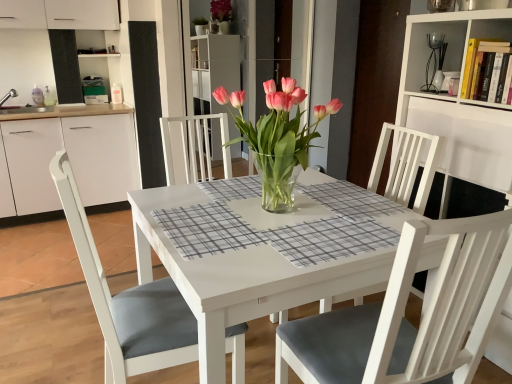
Question: Considering the relative sizes of white wood bookshelf at upper right and white wood chair at center in the image provided, is white wood bookshelf at upper right bigger than white wood chair at center?

Choices:
 (A) no
 (B) yes

Answer: (B)

Question: Is white wood bookshelf at upper right outside white wood chair at center?

Choices:
 (A) yes
 (B) no

Answer: (A)

Question: Can you confirm if white wood bookshelf at upper right is positioned to the right of white wood chair at center?

Choices:
 (A) no
 (B) yes

Answer: (B)

Question: Considering the relative sizes of white wood bookshelf at upper right and white wood chair at center in the image provided, is white wood bookshelf at upper right taller than white wood chair at center?

Choices:
 (A) yes
 (B) no

Answer: (A)

Question: From a real-world perspective, does white wood bookshelf at upper right stand above white wood chair at center?

Choices:
 (A) no
 (B) yes

Answer: (B)

Question: From a real-world perspective, is hardcover books at upper right positioned above or below pink glass vase at center?

Choices:
 (A) above
 (B) below

Answer: (A)

Question: From the image's perspective, is hardcover books at upper right above or below pink glass vase at center?

Choices:
 (A) below
 (B) above

Answer: (B)

Question: Looking at their shapes, would you say hardcover books at upper right is wider or thinner than pink glass vase at center?

Choices:
 (A) wide
 (B) thin

Answer: (B)

Question: Is hardcover books at upper right inside the boundaries of pink glass vase at center, or outside?

Choices:
 (A) inside
 (B) outside

Answer: (B)

Question: Does point (493, 26) appear closer or farther from the camera than point (441, 382)?

Choices:
 (A) farther
 (B) closer

Answer: (A)

Question: Would you say hardcover books at upper right is inside or outside white wood chair at center?

Choices:
 (A) inside
 (B) outside

Answer: (B)

Question: From a real-world perspective, is hardcover books at upper right above or below white wood chair at center?

Choices:
 (A) below
 (B) above

Answer: (B)

Question: In terms of height, does hardcover books at upper right look taller or shorter compared to white wood chair at center?

Choices:
 (A) tall
 (B) short

Answer: (B)

Question: Does point (274, 294) appear closer or farther from the camera than point (281, 104)?

Choices:
 (A) closer
 (B) farther

Answer: (A)

Question: From the image's perspective, is white glossy table at center located above or below pink glass vase at center?

Choices:
 (A) below
 (B) above

Answer: (A)